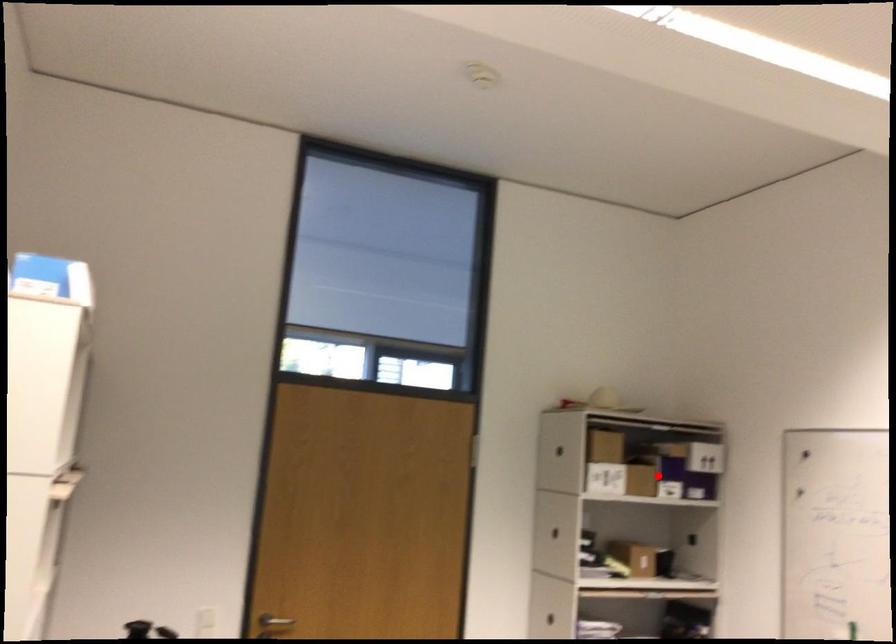
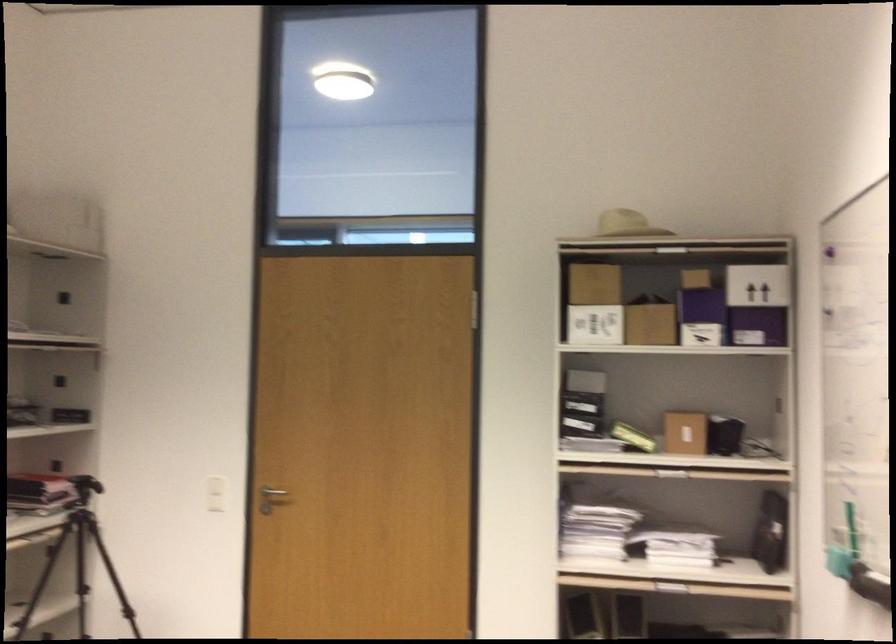
Locate, in the second image, the point that corresponds to the highlighted location in the first image.

(702, 317)